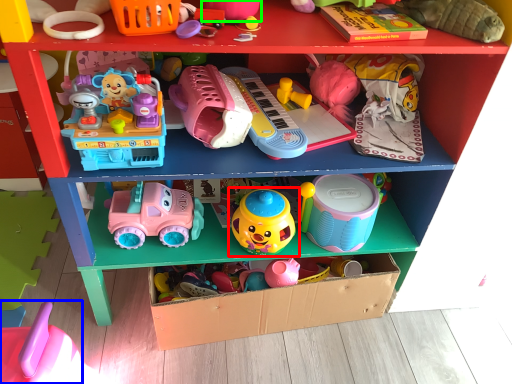
Question: Which is farther away from toy (highlighted by a red box)? toy (highlighted by a blue box) or toy (highlighted by a green box)?

Choices:
 (A) toy
 (B) toy

Answer: (A)